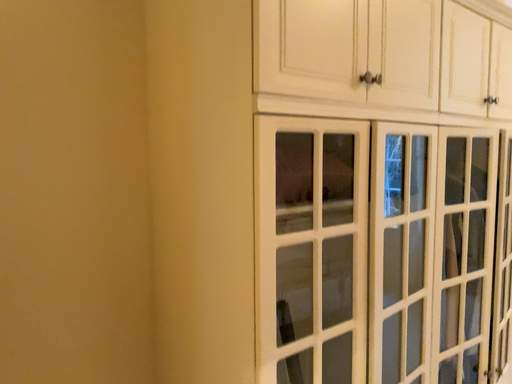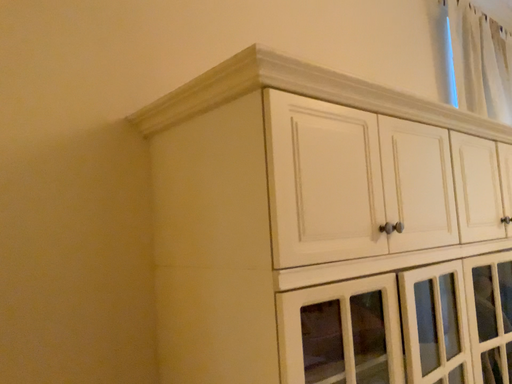
Question: Which way did the camera rotate in the video?

Choices:
 (A) rotated upward
 (B) rotated downward

Answer: (A)